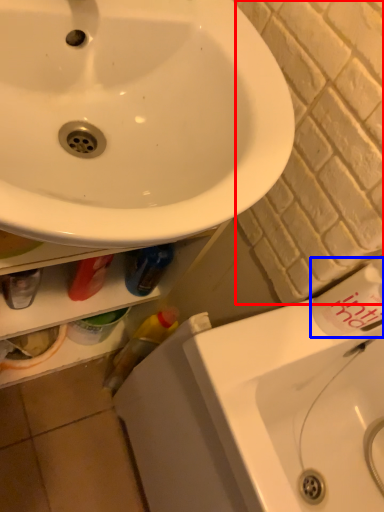
Question: Which of the following is the farthest to the observer, brick (highlighted by a red box) or toiletry (highlighted by a blue box)?

Choices:
 (A) brick
 (B) toiletry

Answer: (B)